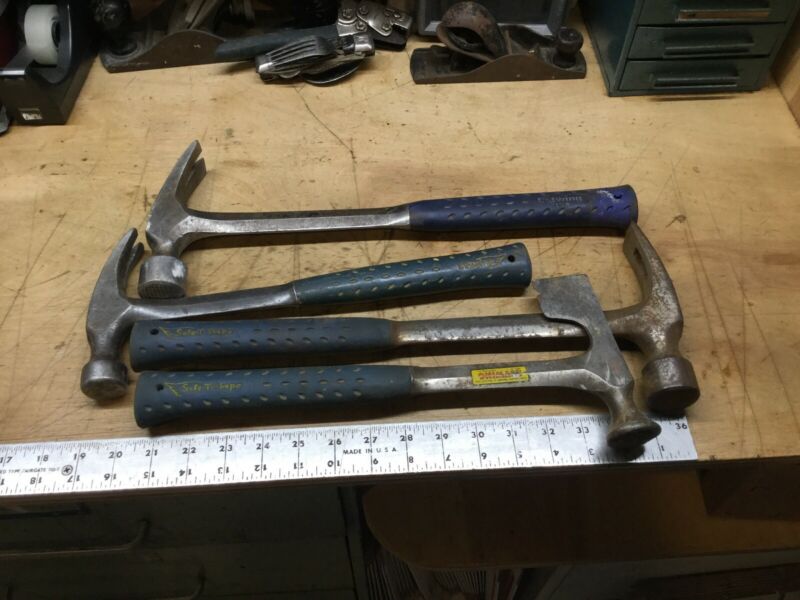
The width and height of the screenshot is (800, 600). What are the coordinates of `cabinets` in the screenshot? It's located at (705, 56).